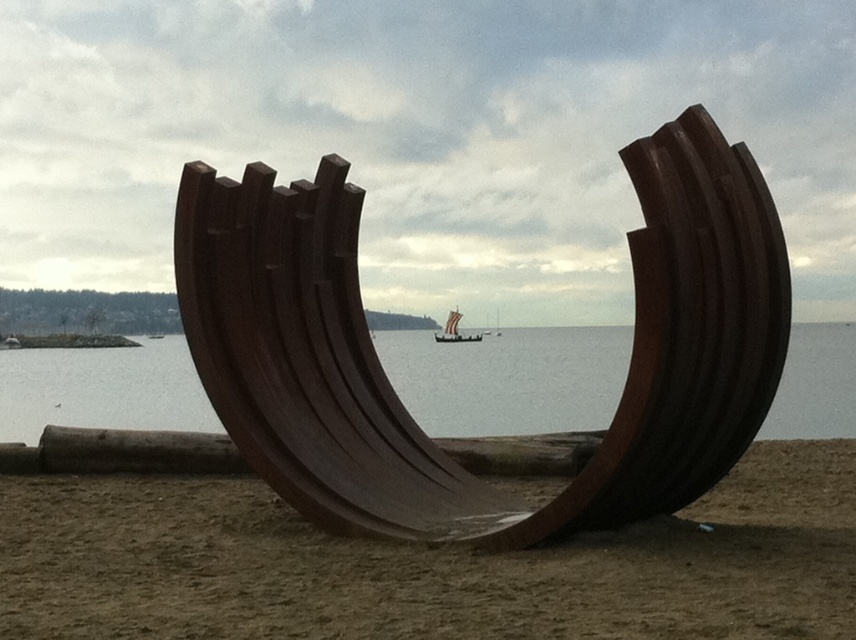
Between rusty metal sculpture at center and wooden viking ship at center, which one has more height?

rusty metal sculpture at center

Does rusty metal sculpture at center lie in front of wooden viking ship at center?

Yes, it is.

Image resolution: width=856 pixels, height=640 pixels. What are the coordinates of `rusty metal sculpture at center` in the screenshot? It's located at (400, 401).

I want to click on rusty metal sculpture at center, so click(x=400, y=401).

Is brown wooden water at center positioned in front of wooden viking ship at center?

Yes, brown wooden water at center is in front of wooden viking ship at center.

Is brown wooden water at center wider than wooden viking ship at center?

Yes.

Between point (411, 348) and point (432, 337), which one is positioned behind?

Point (432, 337)

Where is `brown wooden water at center`? brown wooden water at center is located at coordinates (509, 380).

Measure the distance between rusty metal sculpture at center and camera.

rusty metal sculpture at center and camera are 7.15 meters apart from each other.

Can you confirm if rusty metal sculpture at center is bigger than brown wooden water at center?

No.

This screenshot has width=856, height=640. Describe the element at coordinates (400, 401) in the screenshot. I see `rusty metal sculpture at center` at that location.

The image size is (856, 640). I want to click on rusty metal sculpture at center, so click(x=400, y=401).